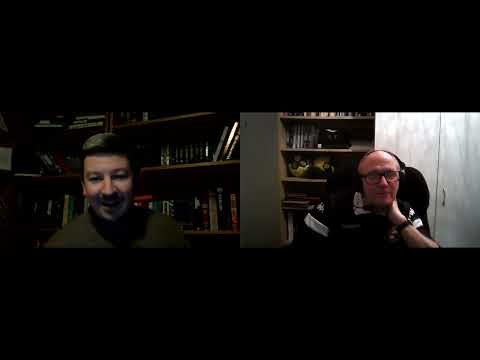
Find the location of `door handle`. door handle is located at coordinates (443, 195).